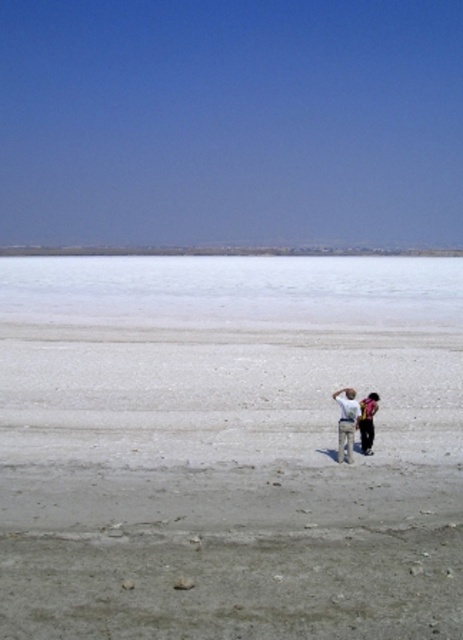
Measure the distance between gray sandy dirt field at center and dark brown leather jacket at lower right.

gray sandy dirt field at center and dark brown leather jacket at lower right are 4.15 meters apart.

Which is above, gray sandy dirt field at center or dark brown leather jacket at lower right?

Positioned higher is dark brown leather jacket at lower right.

Does point (281, 458) lie in front of point (369, 420)?

Yes, it is in front of point (369, 420).

At what (x,y) coordinates should I click in order to perform the action: click on gray sandy dirt field at center. Please return your answer as a coordinate pair (x, y). The height and width of the screenshot is (640, 463). Looking at the image, I should click on tap(226, 484).

Does gray sandy dirt field at center have a greater width compared to white smooth salt lake at center?

No.

Which is above, gray sandy dirt field at center or white smooth salt lake at center?

white smooth salt lake at center

Does point (152, 410) lie behind point (425, 262)?

No, (152, 410) is closer to viewer.

The height and width of the screenshot is (640, 463). I want to click on gray sandy dirt field at center, so click(x=226, y=484).

Can you confirm if white smooth salt lake at center is positioned to the right of dark brown leather jacket at lower right?

In fact, white smooth salt lake at center is to the left of dark brown leather jacket at lower right.

Which is behind, point (1, 264) or point (362, 422)?

Point (1, 264)

I want to click on white smooth salt lake at center, so click(x=233, y=291).